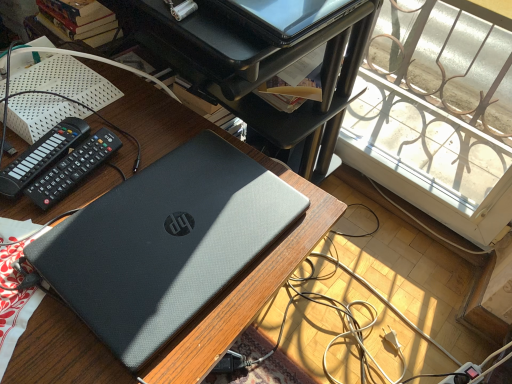
You are a GUI agent. You are given a task and a screenshot of the screen. Output one action in this format:
    pyautogui.click(x=<x>, y=<y>)
    Task: Click on the vacant area to the right of black plastic remote at left, which ranks as the 2th control in right-to-left order
    The width and height of the screenshot is (512, 384).
    Given the screenshot: What is the action you would take?
    pyautogui.click(x=147, y=153)